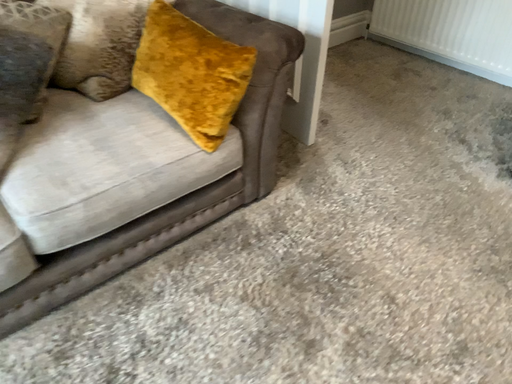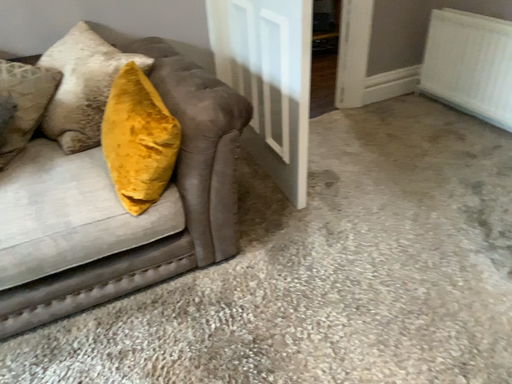
Question: Which way did the camera rotate in the video?

Choices:
 (A) rotated left
 (B) rotated right

Answer: (A)